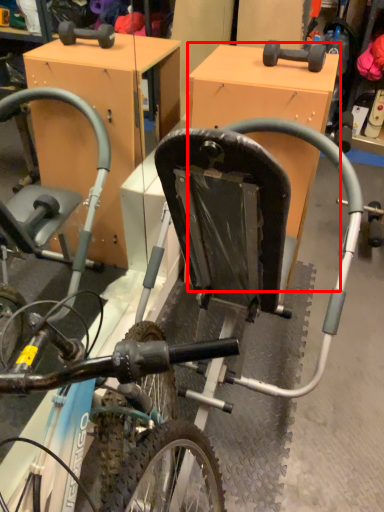
Question: Considering the relative positions of table (annotated by the red box) and bicycle in the image provided, where is table (annotated by the red box) located with respect to the staircase?

Choices:
 (A) right
 (B) left

Answer: (A)